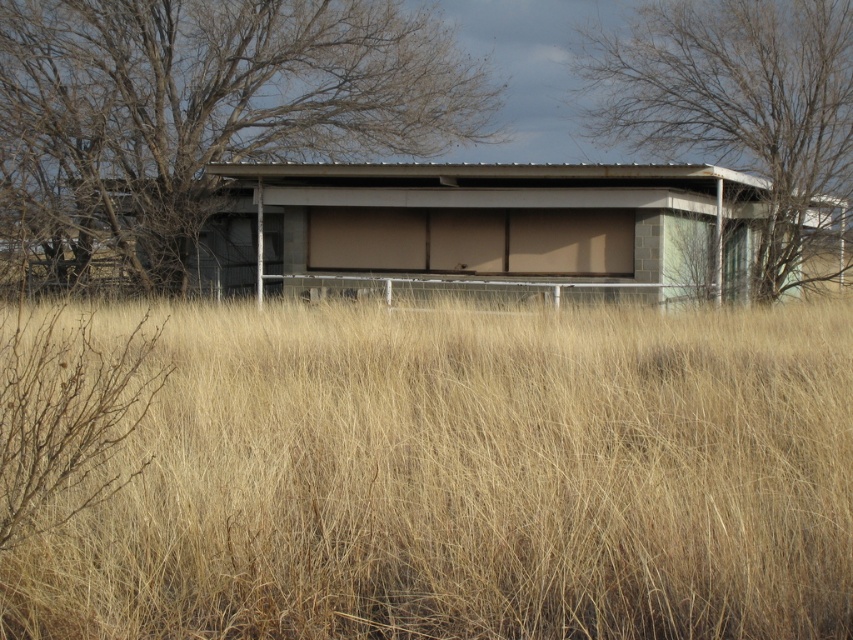
You are standing in front of the large modern building with tall dry grass around you. You see two points marked on the ground. The first point is at coordinate point (148, 499) and the second is at point (589, 209). Which point is closer to you?

Point (148, 499) is closer to you than point (589, 209).

You are standing at the entrance of the large, modern building and want to find the dry grass at center. According to the scene description, where should you look relative to the building?

The dry grass at center is located at point (469, 480), which means it is positioned to the right and slightly above the center of the building. You should look towards the right side and a bit higher than the middle of the building to find the dry grass at center.

You are a farmer checking the visibility of your property. You notice dry grass at center and bare branches at center. Which of these two elements is narrower in width?

The dry grass at center is thinner than the bare branches at center, so the dry grass at center is narrower in width.